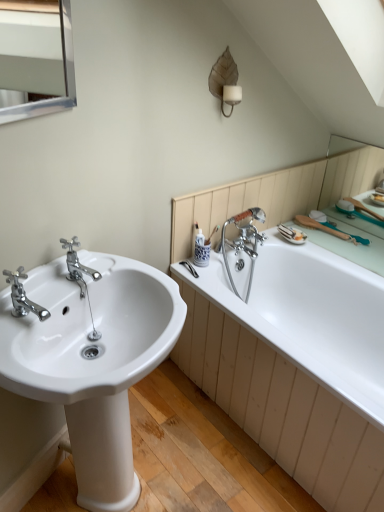
Question: From a real-world perspective, is chrome metallic faucet at left, marked as the first tap in a front-to-back arrangement, physically located above or below matte brown leaf-shaped sconce at upper center?

Choices:
 (A) above
 (B) below

Answer: (B)

Question: Is chrome metallic faucet at left, marked as the first tap in a front-to-back arrangement, taller or shorter than matte brown leaf-shaped sconce at upper center?

Choices:
 (A) tall
 (B) short

Answer: (B)

Question: Estimate the real-world distances between objects in this image. Which object is farther from the matte brown leaf-shaped sconce at upper center?

Choices:
 (A) silver metallic medicine cabinet at upper left
 (B) chrome metallic faucet at left, positioned as the 2th tap in front-to-back order
 (C) white glossy bathtub at right
 (D) chrome metallic faucet at left, marked as the first tap in a front-to-back arrangement
 (E) white glossy sink at left

Answer: (E)

Question: Which object is positioned farthest from the white glossy bathtub at right?

Choices:
 (A) white glossy sink at left
 (B) matte brown leaf-shaped sconce at upper center
 (C) chrome metallic faucet at left, marked as the first tap in a front-to-back arrangement
 (D) chrome metallic faucet at left, positioned as the first tap in back-to-front order
 (E) silver metallic medicine cabinet at upper left

Answer: (E)